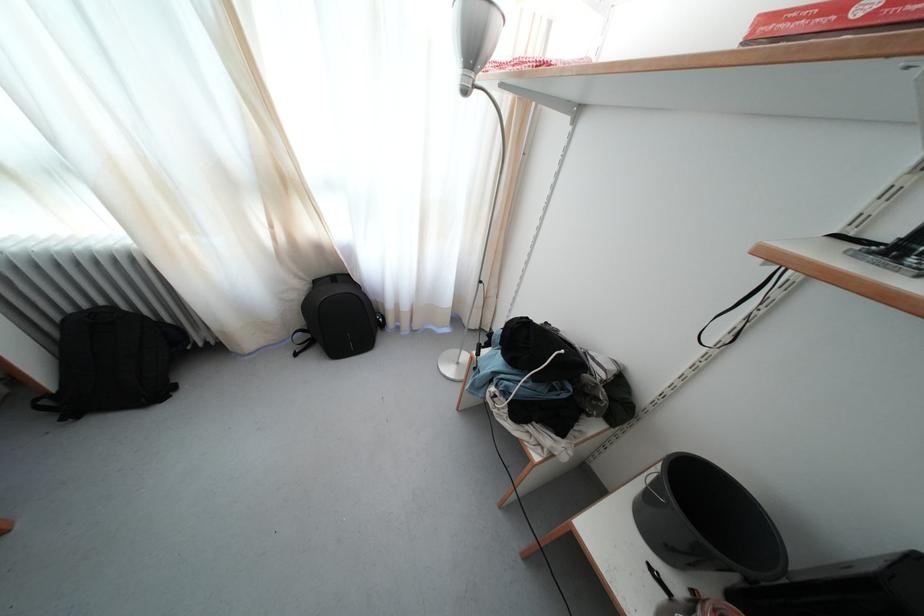
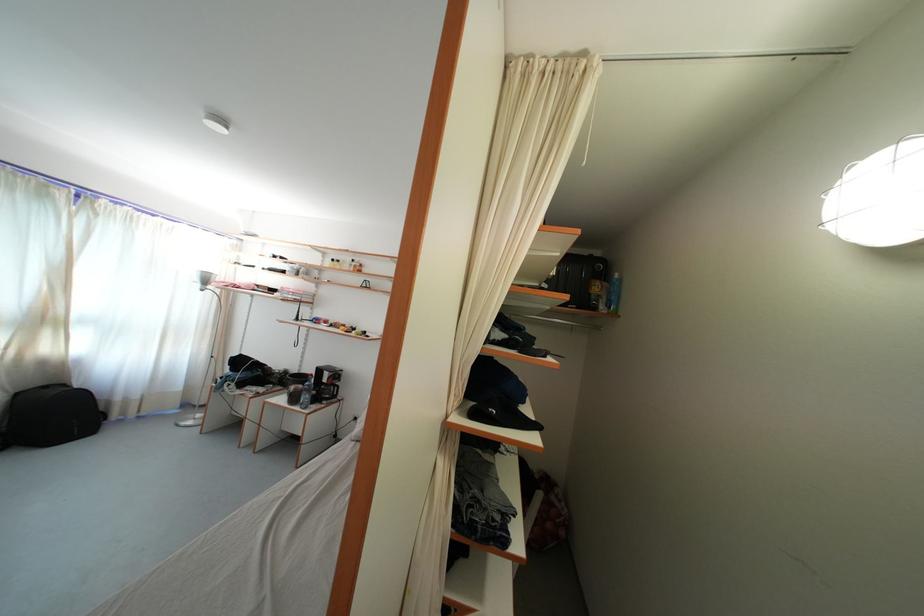
Locate, in the second image, the point that corresponds to point 322,288 in the first image.

(23, 400)